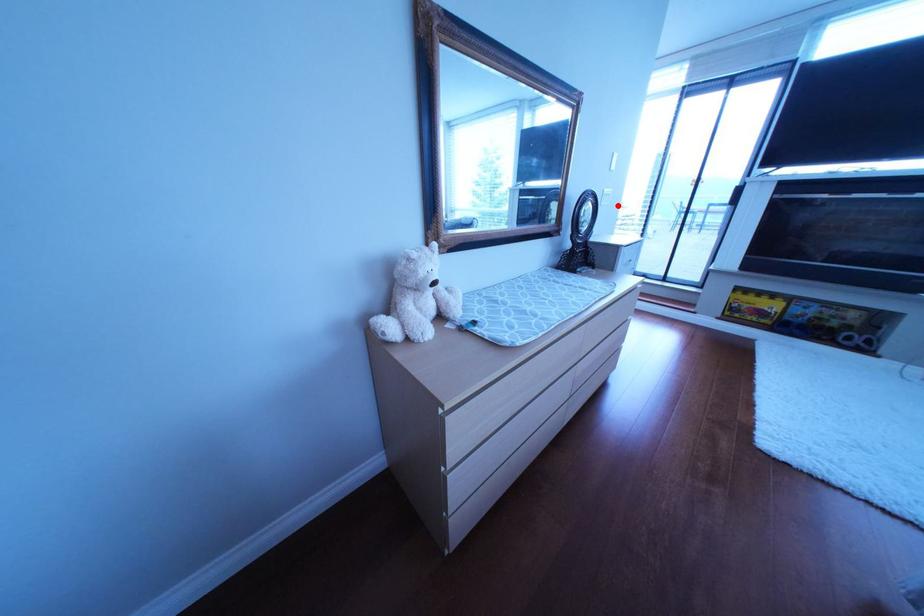
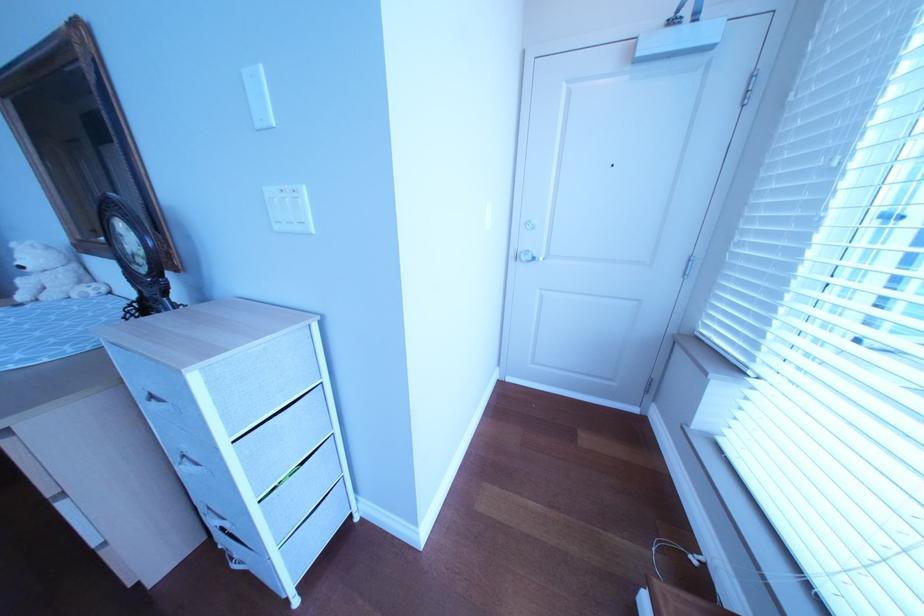
Locate, in the second image, the point that corresponds to the highlighted location in the first image.

(292, 229)